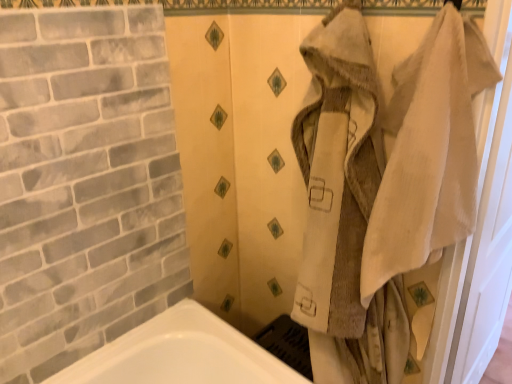
Question: Does white textured towel at right have a lesser width compared to beige fabric screen door at right?

Choices:
 (A) yes
 (B) no

Answer: (B)

Question: Is white textured towel at right oriented towards beige fabric screen door at right?

Choices:
 (A) yes
 (B) no

Answer: (B)

Question: From the image's perspective, does white textured towel at right appear lower than beige fabric screen door at right?

Choices:
 (A) yes
 (B) no

Answer: (B)

Question: Is white textured towel at right bigger than beige fabric screen door at right?

Choices:
 (A) no
 (B) yes

Answer: (A)

Question: Is the depth of white textured towel at right less than that of beige fabric screen door at right?

Choices:
 (A) no
 (B) yes

Answer: (B)

Question: From the image's perspective, is white textured towel at right above beige fabric screen door at right?

Choices:
 (A) no
 (B) yes

Answer: (B)

Question: Is the surface of beige fabric screen door at right in direct contact with white textured towel at right?

Choices:
 (A) no
 (B) yes

Answer: (A)

Question: From the image's perspective, is beige fabric screen door at right under white textured towel at right?

Choices:
 (A) no
 (B) yes

Answer: (B)

Question: Would you say beige fabric screen door at right is outside white textured towel at right?

Choices:
 (A) yes
 (B) no

Answer: (A)

Question: Is beige fabric screen door at right looking in the opposite direction of white textured towel at right?

Choices:
 (A) yes
 (B) no

Answer: (B)

Question: Could you tell me if beige fabric screen door at right is turned towards white textured towel at right?

Choices:
 (A) yes
 (B) no

Answer: (B)

Question: Does beige fabric screen door at right have a smaller size compared to white textured towel at right?

Choices:
 (A) yes
 (B) no

Answer: (B)

Question: From the image's perspective, is beige fabric screen door at right above or below white textured towel at right?

Choices:
 (A) above
 (B) below

Answer: (B)